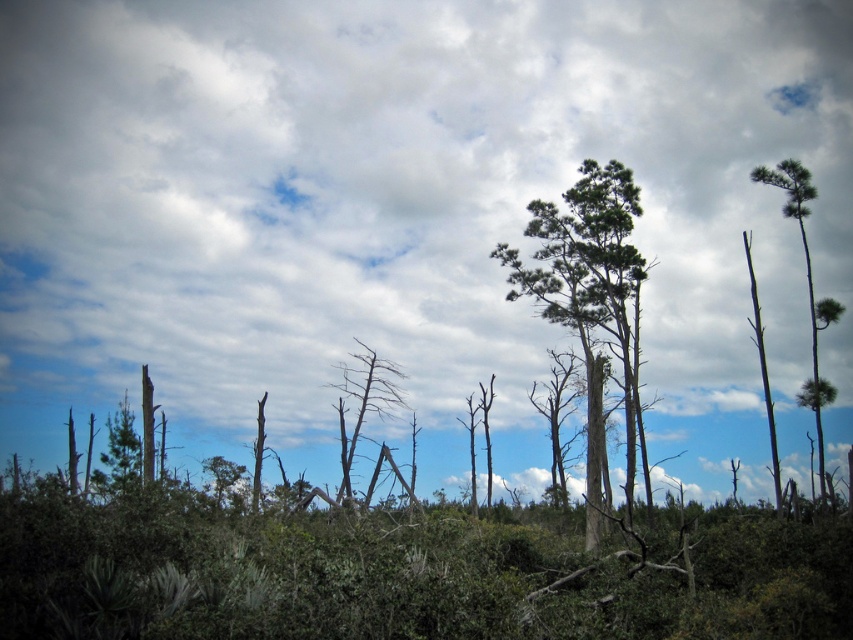
Is point (621, 284) farther from camera compared to point (341, 404)?

Yes, it is behind point (341, 404).

Does green textured pine trees at center have a greater width compared to bare wood tree at center?

Yes.

What do you see at coordinates (590, 298) in the screenshot? This screenshot has height=640, width=853. I see `green textured pine trees at center` at bounding box center [590, 298].

This screenshot has width=853, height=640. What are the coordinates of `green textured pine trees at center` in the screenshot? It's located at (590, 298).

Is cloudy sky at upper center wider than green textured pine trees at center?

Correct, the width of cloudy sky at upper center exceeds that of green textured pine trees at center.

Who is more distant from viewer, (155,204) or (570,266)?

Point (155,204)

Identify the location of cloudy sky at upper center. The image size is (853, 640). (398, 196).

Is green textured pine tree at upper right shorter than bare wood tree at center?

No, green textured pine tree at upper right is not shorter than bare wood tree at center.

Can you confirm if green textured pine tree at upper right is smaller than bare wood tree at center?

Incorrect, green textured pine tree at upper right is not smaller in size than bare wood tree at center.

What do you see at coordinates (805, 278) in the screenshot? I see `green textured pine tree at upper right` at bounding box center [805, 278].

I want to click on green textured pine tree at upper right, so [805, 278].